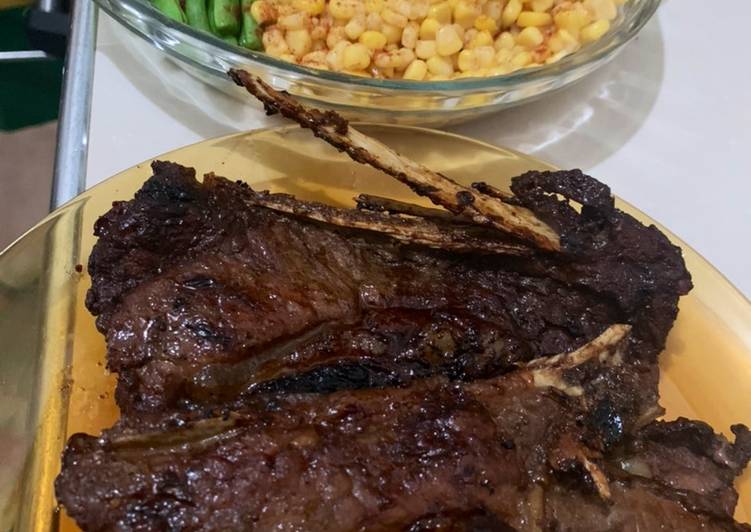
Locate an element on the screen. This screenshot has height=532, width=751. transparent plate is located at coordinates (x=731, y=334).